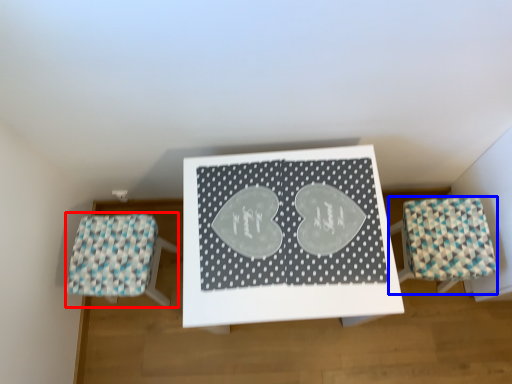
Question: Among these objects, which one is farthest to the camera, furniture (highlighted by a red box) or furniture (highlighted by a blue box)?

Choices:
 (A) furniture
 (B) furniture

Answer: (A)